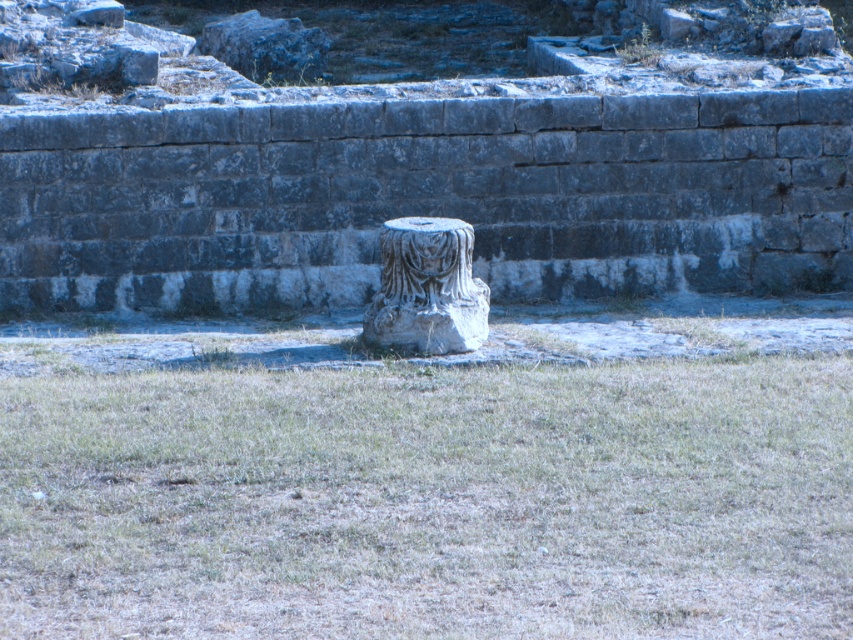
You are an archaeologist examining the site. You notice the green grass at center and the carved stone pedestal at center. Which of these two occupies a larger area in the scene?

The carved stone pedestal at center occupies a larger area than the green grass at center.